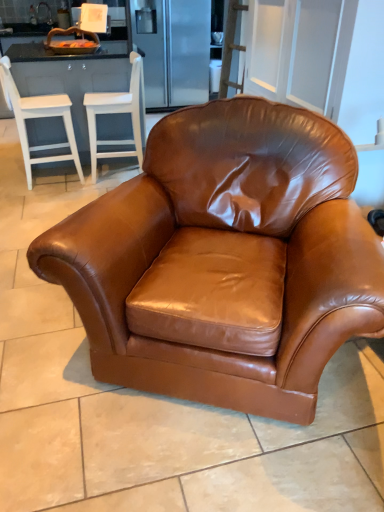
Question: Is white wood bar stool at left, positioned as the 3th chair in right-to-left order, spatially inside white wood barstools at left, or outside of it?

Choices:
 (A) outside
 (B) inside

Answer: (A)

Question: Is white wood bar stool at left, placed as the second chair when sorted from back to front, wider or thinner than white wood barstools at left?

Choices:
 (A) thin
 (B) wide

Answer: (A)

Question: Which is farther from the brown leather armchair at center, the second chair viewed from the left?

Choices:
 (A) white wood barstools at left
 (B) white wood bar stool at left, positioned as the 3th chair in right-to-left order
 (C) saddle brown leather armchair at center, acting as the third chair starting from the back

Answer: (C)

Question: Which object is positioned farthest from the brown leather armchair at center, the third chair in the front-to-back sequence?

Choices:
 (A) white wood bar stool at left, arranged as the second chair when viewed from the front
 (B) white wood barstools at left
 (C) saddle brown leather armchair at center, which ranks as the 1th chair in right-to-left order

Answer: (C)